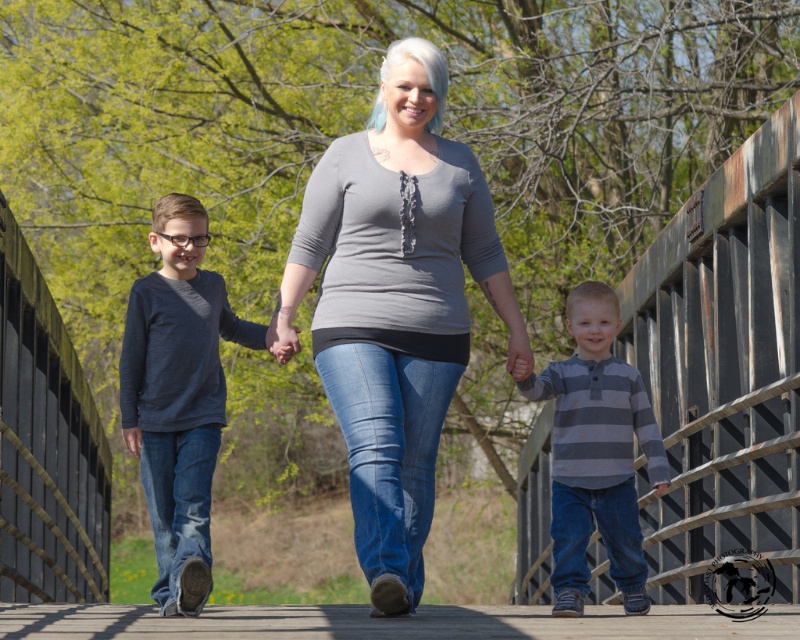
Is gray textured shirt at center in front of gray striped shirt at center?

Yes.

Between gray textured shirt at center and gray striped shirt at center, which one has more height?

gray textured shirt at center is taller.

Who is more distant from viewer, (358, 300) or (637, 592)?

Positioned behind is point (637, 592).

The width and height of the screenshot is (800, 640). Identify the location of gray textured shirt at center. (396, 305).

Looking at this image, who is positioned more to the left, gray textured shirt at center or dark blue denim jeans at left?

dark blue denim jeans at left is more to the left.

Does gray textured shirt at center come in front of dark blue denim jeans at left?

Yes, it is in front of dark blue denim jeans at left.

This screenshot has height=640, width=800. What are the coordinates of `gray textured shirt at center` in the screenshot? It's located at (396, 305).

Is dark blue denim jeans at left to the right of gray striped shirt at center from the viewer's perspective?

No, dark blue denim jeans at left is not to the right of gray striped shirt at center.

Is point (196, 364) more distant than point (620, 321)?

No, (196, 364) is closer to viewer.

Is point (224, 285) farther from viewer compared to point (601, 456)?

Yes, it is behind point (601, 456).

Locate an element on the screen. This screenshot has width=800, height=640. dark blue denim jeans at left is located at coordinates (178, 396).